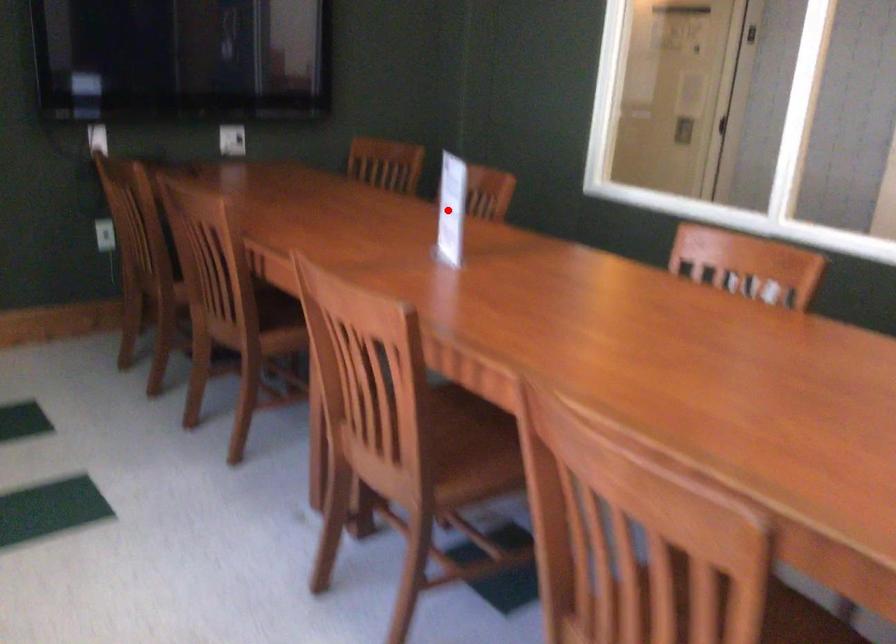
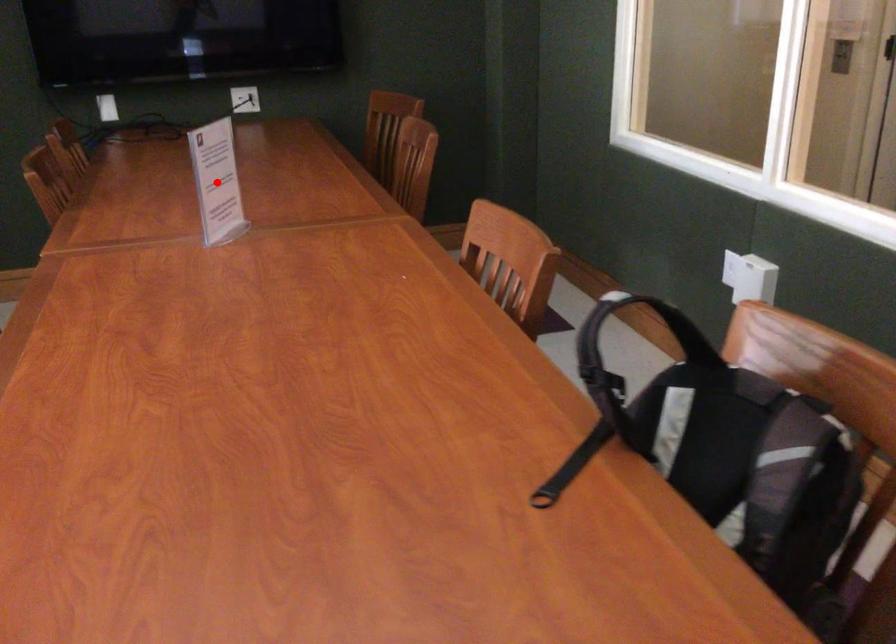
I am providing you with two images of the same scene from different viewpoints. A red point is marked on the first image and another point is marked on the second image. Is the marked point in image1 the same physical position as the marked point in image2?

Yes